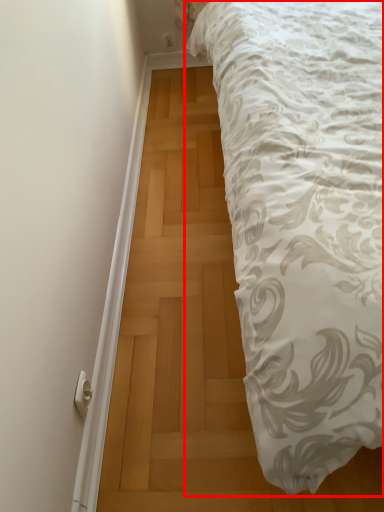
Question: From the image's perspective, where is bed (annotated by the red box) located in relation to door handle in the image?

Choices:
 (A) below
 (B) above

Answer: (B)